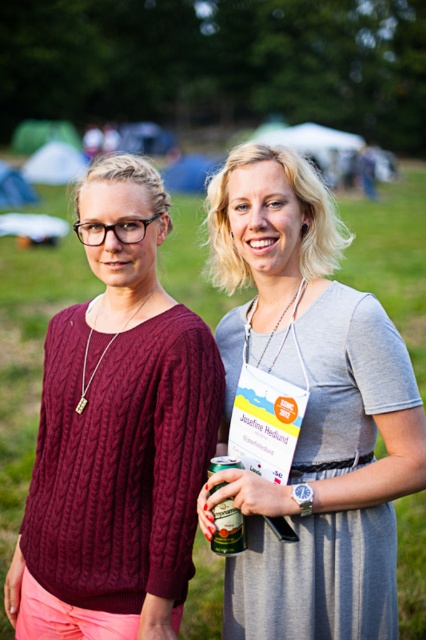
Question: Which of the following is the farthest from the observer?

Choices:
 (A) (393, 545)
 (B) (221, 515)
 (C) (72, 410)

Answer: (C)

Question: Is gray cotton dress at center positioned in front of cable-knit sweater at center?

Choices:
 (A) no
 (B) yes

Answer: (B)

Question: Which object is farther from the camera taking this photo?

Choices:
 (A) gray cotton dress at center
 (B) green matte can at center

Answer: (B)

Question: Is cable-knit sweater at center behind green matte can at center?

Choices:
 (A) no
 (B) yes

Answer: (B)

Question: Observing the image, what is the correct spatial positioning of gray cotton dress at center in reference to cable-knit sweater at center?

Choices:
 (A) right
 (B) left

Answer: (A)

Question: Which of the following is the farthest from the observer?

Choices:
 (A) (227, 460)
 (B) (275, 582)

Answer: (B)